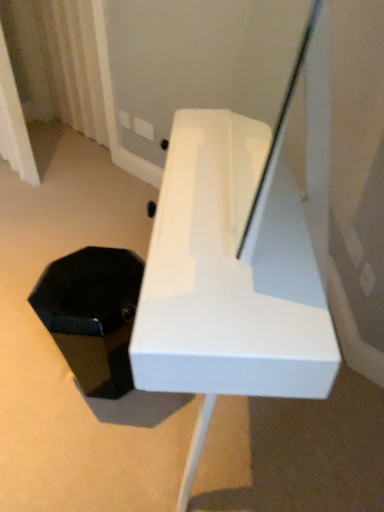
Locate an element on the screen. blank area to the left of white glossy bench at center is located at coordinates (50, 390).